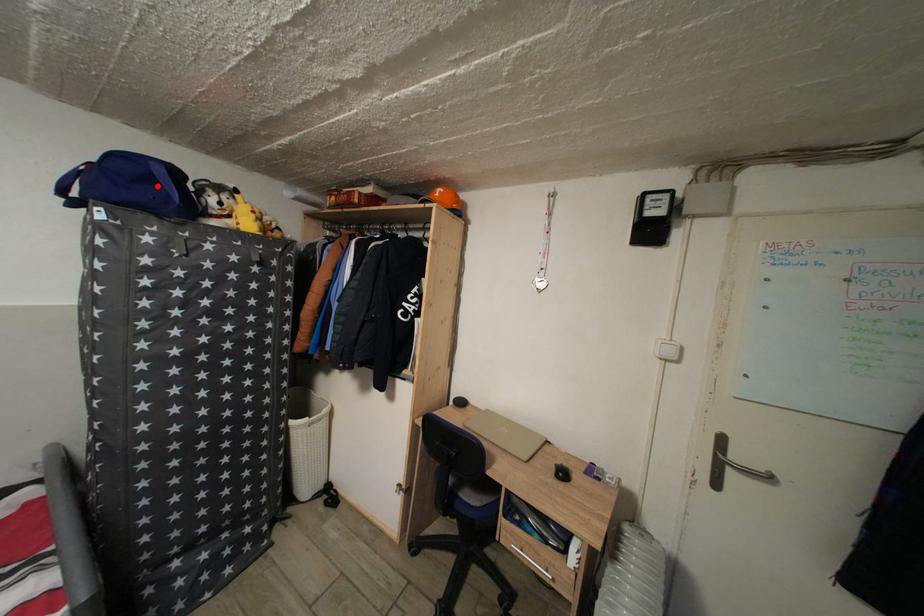
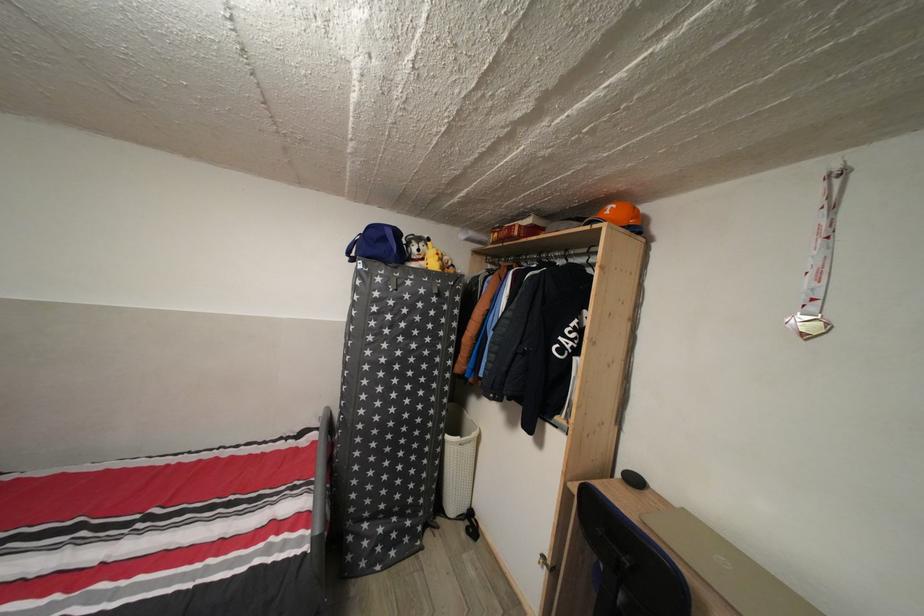
Where in the second image is the point corresponding to the highlighted location from the first image?

(391, 246)